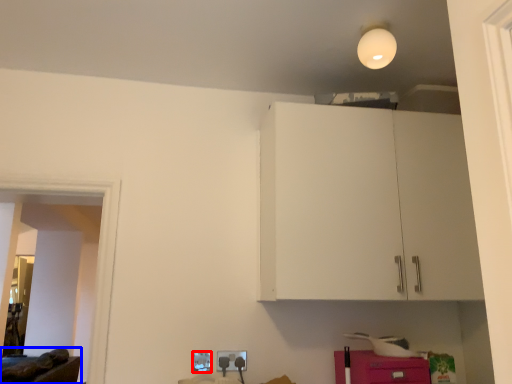
Question: Which point is closer to the camera, electric outlet (highlighted by a red box) or furniture (highlighted by a blue box)?

Choices:
 (A) electric outlet
 (B) furniture

Answer: (A)